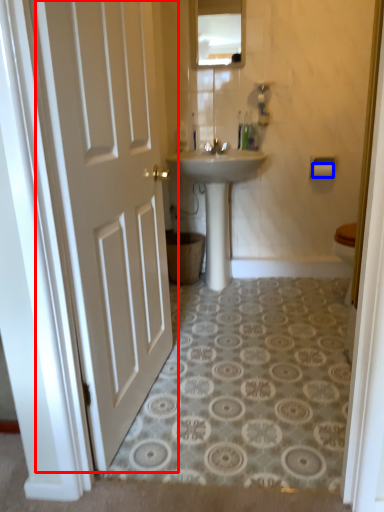
Question: Which point is further to the camera, door (highlighted by a red box) or toilet paper (highlighted by a blue box)?

Choices:
 (A) door
 (B) toilet paper

Answer: (B)